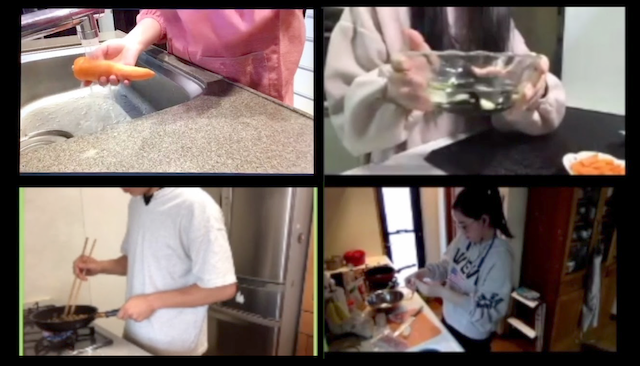
Identify the location of dishes. (396, 297), (457, 82), (52, 316).